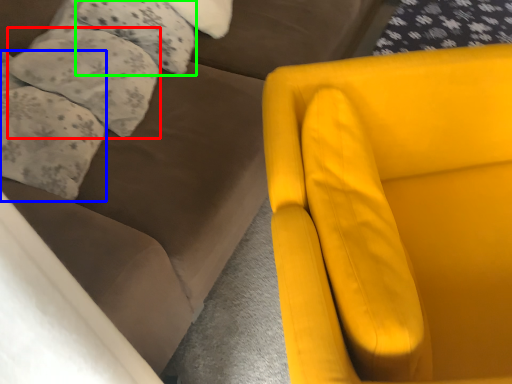
Question: Considering the real-world distances, which object is closest to pillow (highlighted by a red box)? pillow (highlighted by a blue box) or pillow (highlighted by a green box).

Choices:
 (A) pillow
 (B) pillow

Answer: (A)